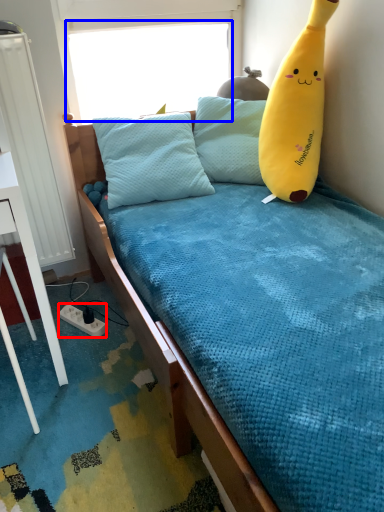
Question: Which object appears farthest to the camera in this image, power outlet (highlighted by a red box) or window screen (highlighted by a blue box)?

Choices:
 (A) power outlet
 (B) window screen

Answer: (A)